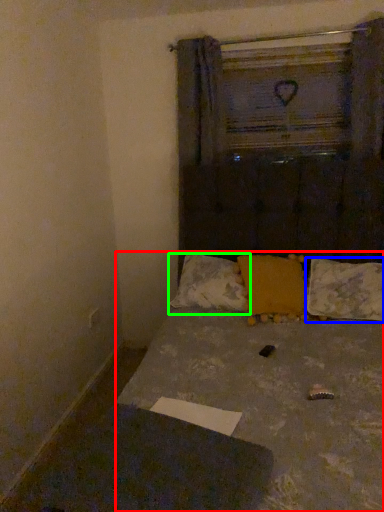
Question: Based on their relative distances, which object is farther from bed (highlighted by a red box)? Choose from pillow (highlighted by a blue box) and pillow (highlighted by a green box).

Choices:
 (A) pillow
 (B) pillow

Answer: (A)